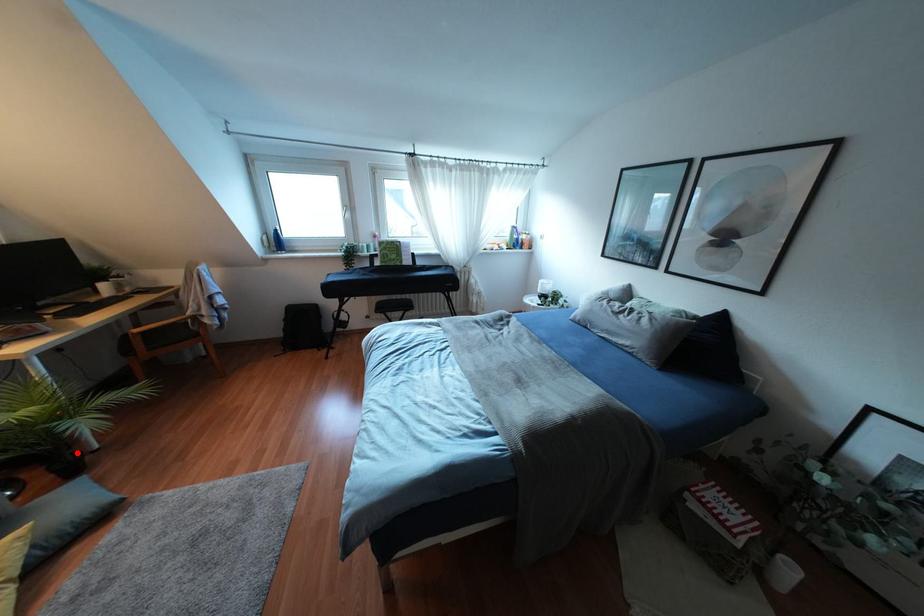
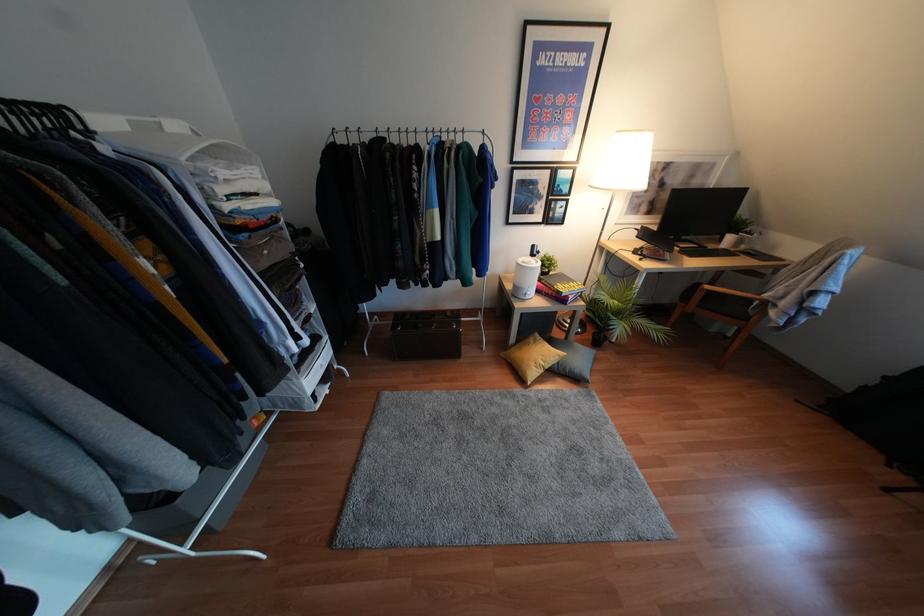
In the second image, find the point that corresponds to the highlighted location in the first image.

(604, 336)